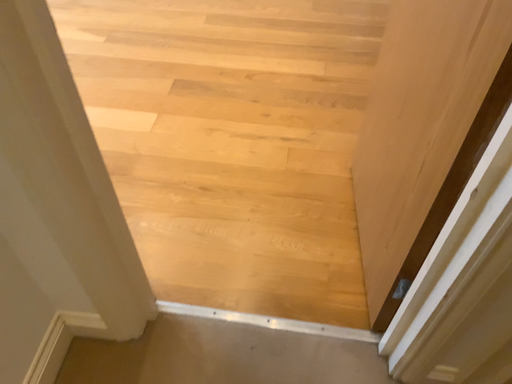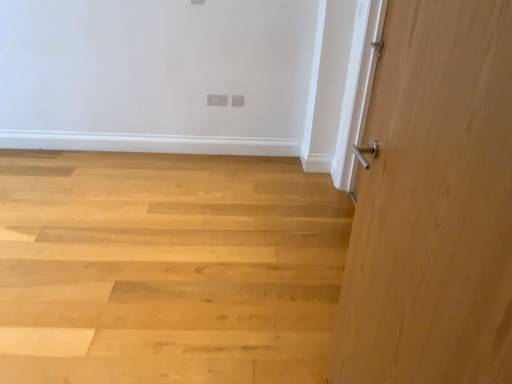
Question: Which way did the camera rotate in the video?

Choices:
 (A) rotated left
 (B) rotated right

Answer: (B)